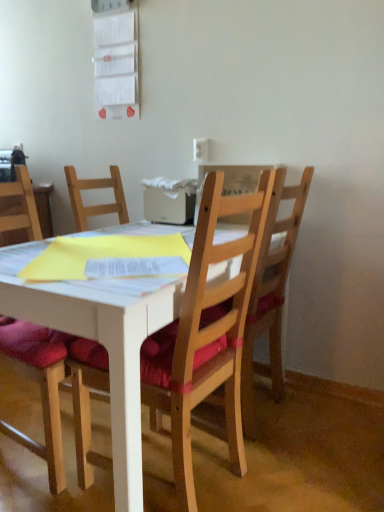
Question: Could you tell me if wooden chair at right, placed as the third chair when sorted from left to right, is facing white plastic power outlet at upper center?

Choices:
 (A) yes
 (B) no

Answer: (B)

Question: Considering the relative sizes of wooden chair at right, the 1th chair in the right-to-left sequence, and white plastic power outlet at upper center in the image provided, is wooden chair at right, the 1th chair in the right-to-left sequence, thinner than white plastic power outlet at upper center?

Choices:
 (A) no
 (B) yes

Answer: (A)

Question: Would you consider wooden chair at right, placed as the third chair when sorted from left to right, to be distant from white plastic power outlet at upper center?

Choices:
 (A) yes
 (B) no

Answer: (B)

Question: Is wooden chair at right, the 1th chair in the right-to-left sequence, behind white plastic power outlet at upper center?

Choices:
 (A) no
 (B) yes

Answer: (A)

Question: From the image's perspective, is wooden chair at right, the 1th chair in the right-to-left sequence, located beneath white plastic power outlet at upper center?

Choices:
 (A) no
 (B) yes

Answer: (B)

Question: Is white plastic power outlet at upper center inside the boundaries of wooden chair at center, the 2th chair from the left, or outside?

Choices:
 (A) outside
 (B) inside

Answer: (A)

Question: Relative to wooden chair at center, the 2th chair from the left, is white plastic power outlet at upper center in front or behind?

Choices:
 (A) behind
 (B) front

Answer: (A)

Question: From the image's perspective, is white plastic power outlet at upper center located above or below wooden chair at center, the 2th chair positioned from the right?

Choices:
 (A) below
 (B) above

Answer: (B)

Question: Based on their positions, is white plastic power outlet at upper center located to the left or right of wooden chair at center, the 2th chair positioned from the right?

Choices:
 (A) right
 (B) left

Answer: (A)

Question: From a real-world perspective, is white plastic power outlet at upper center positioned above or below wooden chair at right, the 1th chair in the right-to-left sequence?

Choices:
 (A) above
 (B) below

Answer: (A)

Question: Considering the positions of white plastic power outlet at upper center and wooden chair at right, the 1th chair in the right-to-left sequence, in the image, is white plastic power outlet at upper center wider or thinner than wooden chair at right, the 1th chair in the right-to-left sequence,?

Choices:
 (A) wide
 (B) thin

Answer: (B)

Question: Do you think white plastic power outlet at upper center is within wooden chair at right, placed as the third chair when sorted from left to right, or outside of it?

Choices:
 (A) inside
 (B) outside

Answer: (B)

Question: Looking at the image, does white plastic power outlet at upper center seem bigger or smaller compared to wooden chair at right, the 1th chair in the right-to-left sequence?

Choices:
 (A) big
 (B) small

Answer: (B)

Question: From a real-world perspective, is wooden chair at right, placed as the third chair when sorted from left to right, above or below wooden chair at center, the 2th chair from the left?

Choices:
 (A) below
 (B) above

Answer: (B)

Question: Considering the positions of wooden chair at right, the 1th chair in the right-to-left sequence, and wooden chair at center, the 2th chair positioned from the right, in the image, is wooden chair at right, the 1th chair in the right-to-left sequence, bigger or smaller than wooden chair at center, the 2th chair positioned from the right,?

Choices:
 (A) small
 (B) big

Answer: (A)